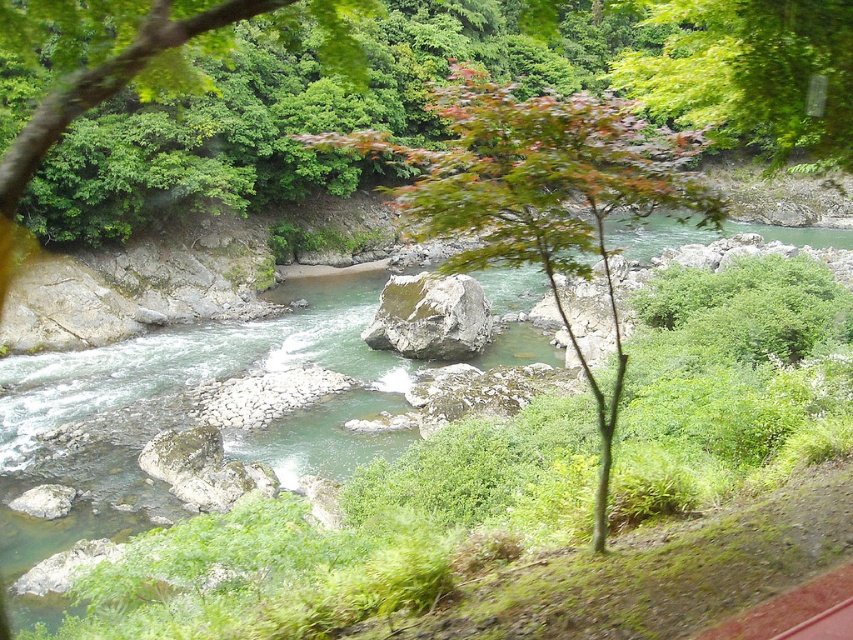
You are a hiker standing at the edge of the river and want to cross it. You notice two points in the riverbed marked as point (544,104) and point (776,72). Which point would you choose to step on first if you want to take the shortest path towards the opposite bank?

You should step on point (544,104) first because it is closer to you than point (776,72), making it the shorter path towards the opposite bank.

You are a bird flying over the river and want to land on a tree. Which tree is closer to the water surface, the green leafy tree at center or the green leafy tree at upper center?

The green leafy tree at center is closer to the water surface because it is positioned below the green leafy tree at upper center.

Looking at this image, you are standing at the origin point of the image and want to reach a hidden treasure located at point (x=474, y=301). There is an obstacle at point (x=625, y=168). Will you encounter the obstacle before reaching the treasure?

Yes, you will encounter the obstacle at point (x=625, y=168) before reaching the treasure at point (x=474, y=301) because point (x=625, y=168) is in front of point (x=474, y=301).